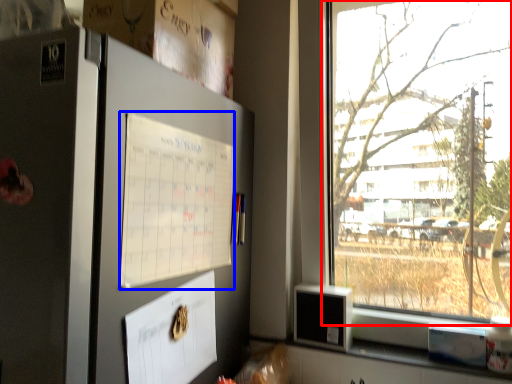
Question: Which object appears closest to the camera in this image, window (highlighted by a red box) or poster (highlighted by a blue box)?

Choices:
 (A) window
 (B) poster

Answer: (B)